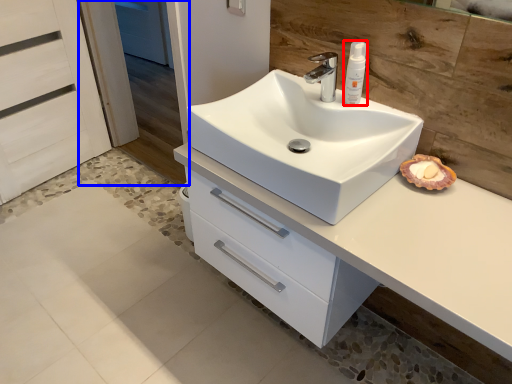
Question: Which object appears farthest to the camera in this image, toiletry (highlighted by a red box) or screen door (highlighted by a blue box)?

Choices:
 (A) toiletry
 (B) screen door

Answer: (B)